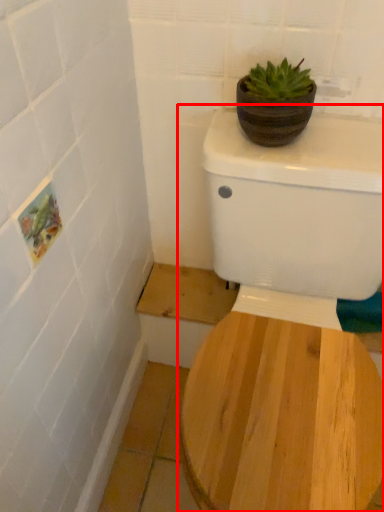
Question: Observing the image, what is the correct spatial positioning of toilet (annotated by the red box) in reference to flowerpot?

Choices:
 (A) right
 (B) left

Answer: (A)